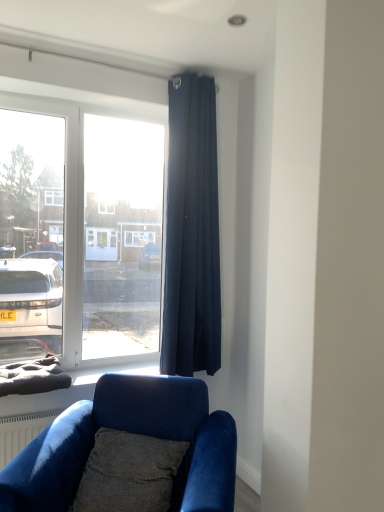
Question: Is point (157, 505) closer or farther from the camera than point (201, 264)?

Choices:
 (A) farther
 (B) closer

Answer: (B)

Question: Considering their positions, is textured gray pillow at lower center located in front of or behind dark blue fabric curtain at upper right?

Choices:
 (A) behind
 (B) front

Answer: (B)

Question: Which object is the farthest from the velvet blue couch at lower left?

Choices:
 (A) textured gray pillow at lower center
 (B) dark blue fabric curtain at upper right

Answer: (B)

Question: Estimate the real-world distances between objects in this image. Which object is closer to the velvet blue couch at lower left?

Choices:
 (A) textured gray pillow at lower center
 (B) dark blue fabric curtain at upper right

Answer: (A)